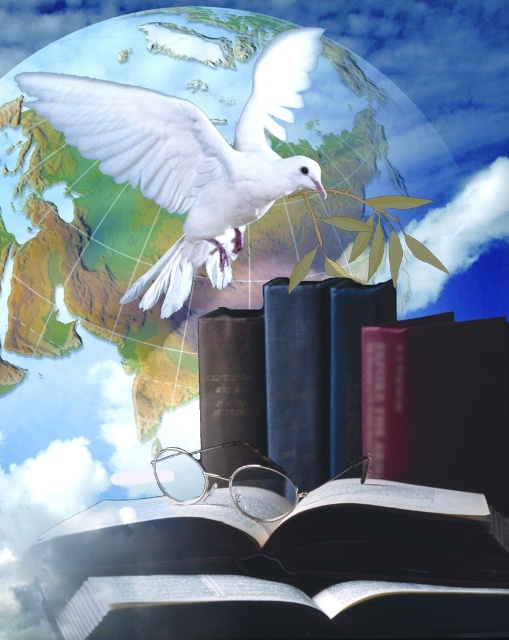
Which is more to the right, matte black book at center or white matte dove at upper center?

matte black book at center

Does matte black book at center have a lesser width compared to white matte dove at upper center?

In fact, matte black book at center might be wider than white matte dove at upper center.

What are the coordinates of `matte black book at center` in the screenshot? It's located at (270, 547).